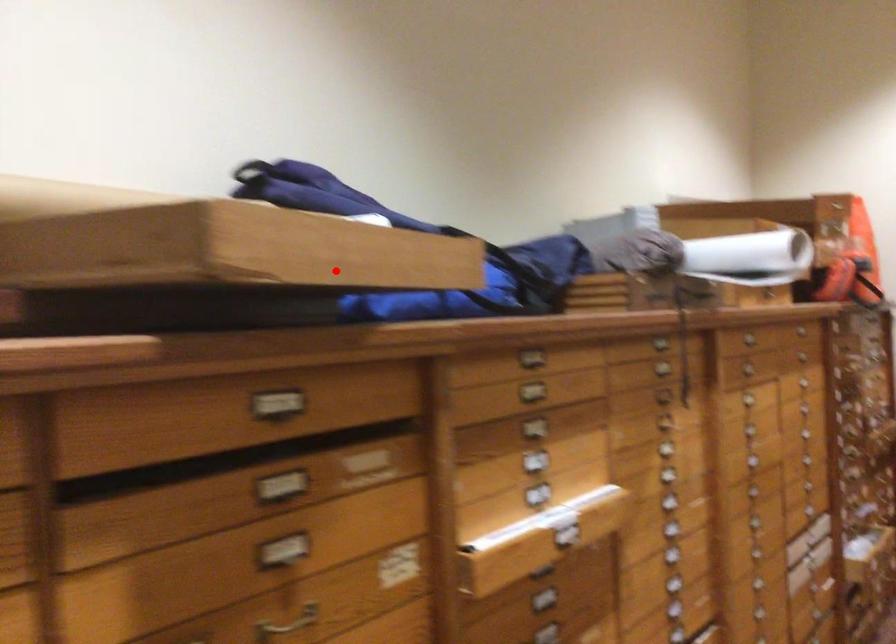
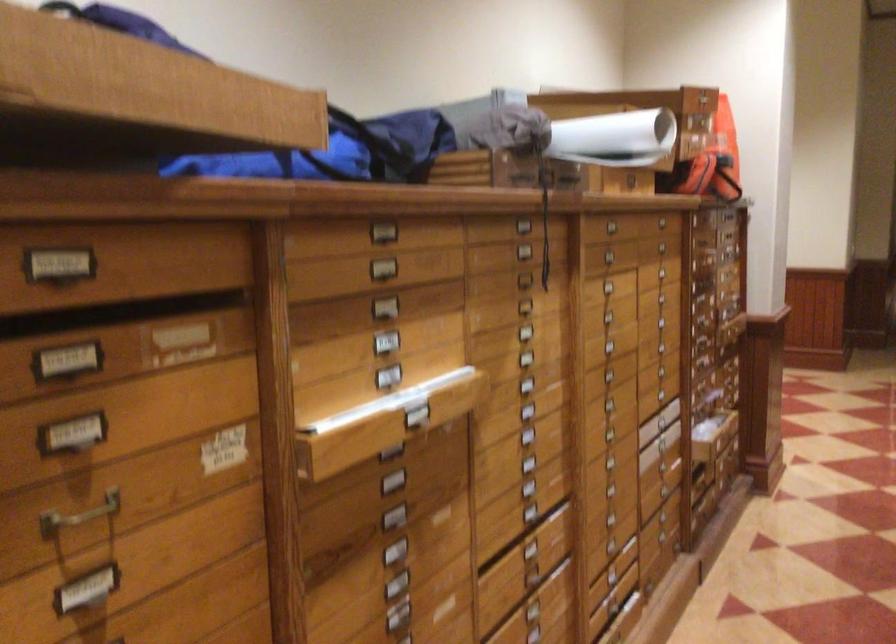
Question: A red point is marked in image1. In image2, is the corresponding 3D point closer to the camera or farther? Reply with the corresponding letter.

Choices:
 (A) The corresponding 3D point is closer.
 (B) The corresponding 3D point is farther.

Answer: (A)